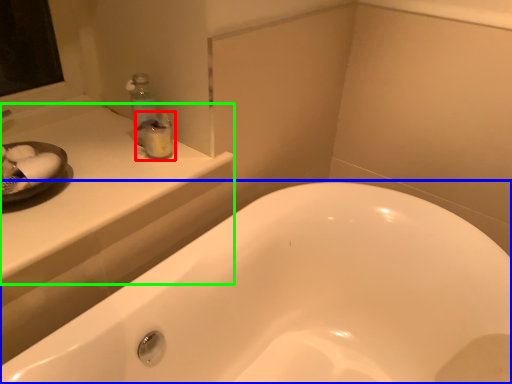
Question: Which is nearer to the toiletry (highlighted by a red box)? bathtub (highlighted by a blue box) or counter top (highlighted by a green box).

Choices:
 (A) bathtub
 (B) counter top

Answer: (B)